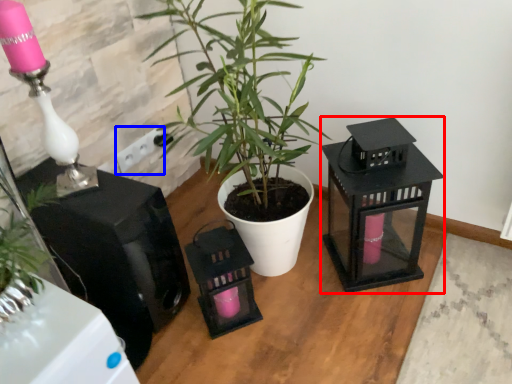
Question: Among these objects, which one is nearest to the camera, appliance (highlighted by a red box) or electric outlet (highlighted by a blue box)?

Choices:
 (A) appliance
 (B) electric outlet

Answer: (A)